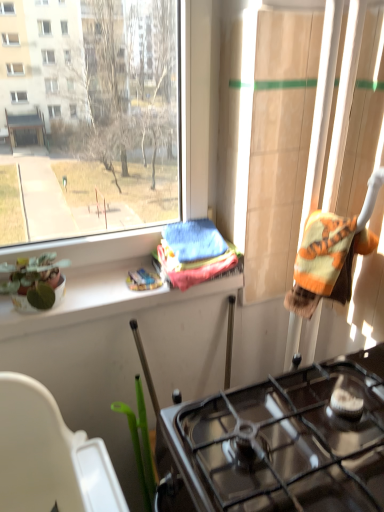
Question: Is green glossy plant pot at lower left to the left of black glass gas stove at lower center from the viewer's perspective?

Choices:
 (A) no
 (B) yes

Answer: (B)

Question: Is black glass gas stove at lower center at the back of green glossy plant pot at lower left?

Choices:
 (A) yes
 (B) no

Answer: (B)

Question: Can black glass gas stove at lower center be found inside green glossy plant pot at lower left?

Choices:
 (A) no
 (B) yes

Answer: (A)

Question: Does green glossy plant pot at lower left touch black glass gas stove at lower center?

Choices:
 (A) yes
 (B) no

Answer: (B)

Question: Can we say green glossy plant pot at lower left lies outside black glass gas stove at lower center?

Choices:
 (A) no
 (B) yes

Answer: (B)

Question: Considering the relative sizes of green glossy plant pot at lower left and black glass gas stove at lower center in the image provided, is green glossy plant pot at lower left bigger than black glass gas stove at lower center?

Choices:
 (A) no
 (B) yes

Answer: (A)

Question: Does black glass gas stove at lower center come in front of green glossy plant pot at lower left?

Choices:
 (A) yes
 (B) no

Answer: (A)

Question: Is black glass gas stove at lower center touching green glossy plant pot at lower left?

Choices:
 (A) yes
 (B) no

Answer: (B)

Question: From the image's perspective, is black glass gas stove at lower center located above green glossy plant pot at lower left?

Choices:
 (A) no
 (B) yes

Answer: (A)

Question: Can you confirm if black glass gas stove at lower center is shorter than green glossy plant pot at lower left?

Choices:
 (A) no
 (B) yes

Answer: (A)

Question: Is black glass gas stove at lower center located outside green glossy plant pot at lower left?

Choices:
 (A) no
 (B) yes

Answer: (B)

Question: Is green glossy plant pot at lower left located within black glass gas stove at lower center?

Choices:
 (A) yes
 (B) no

Answer: (B)

Question: Does black glass gas stove at lower center appear on the left side of green matte plant pot at left?

Choices:
 (A) yes
 (B) no

Answer: (B)